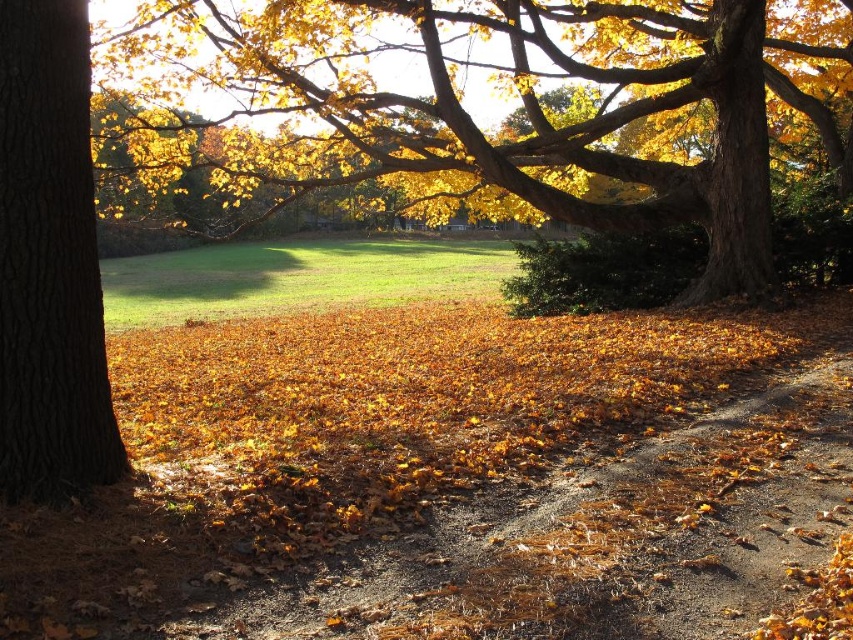
You are standing in the park and want to take a photo of both the golden leafy tree at center and the brown rough bark tree at left. Which tree should you focus on first to ensure both are in the frame?

You should focus on the golden leafy tree at center first because it is closer to you than the brown rough bark tree at left, so adjusting the camera to include both would require starting with the closer one.